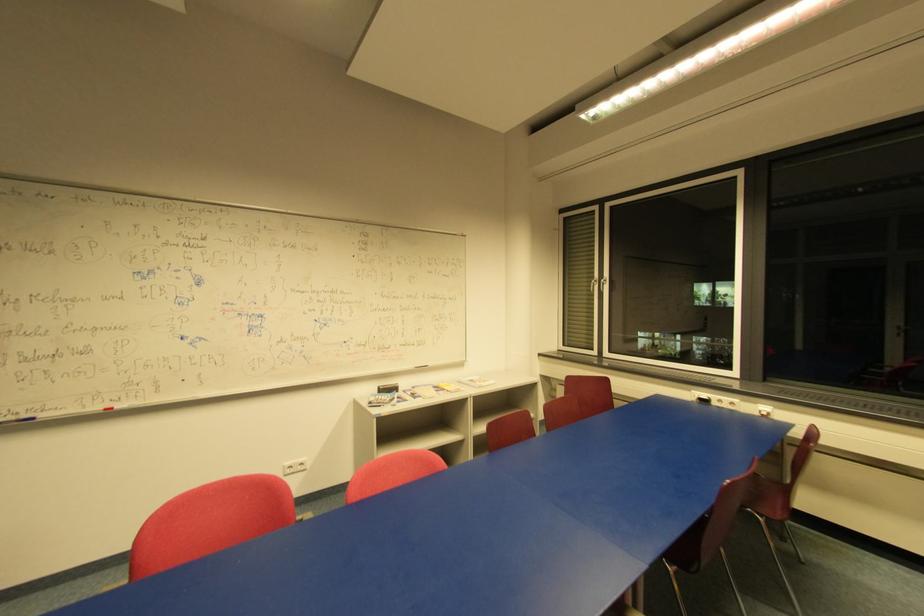
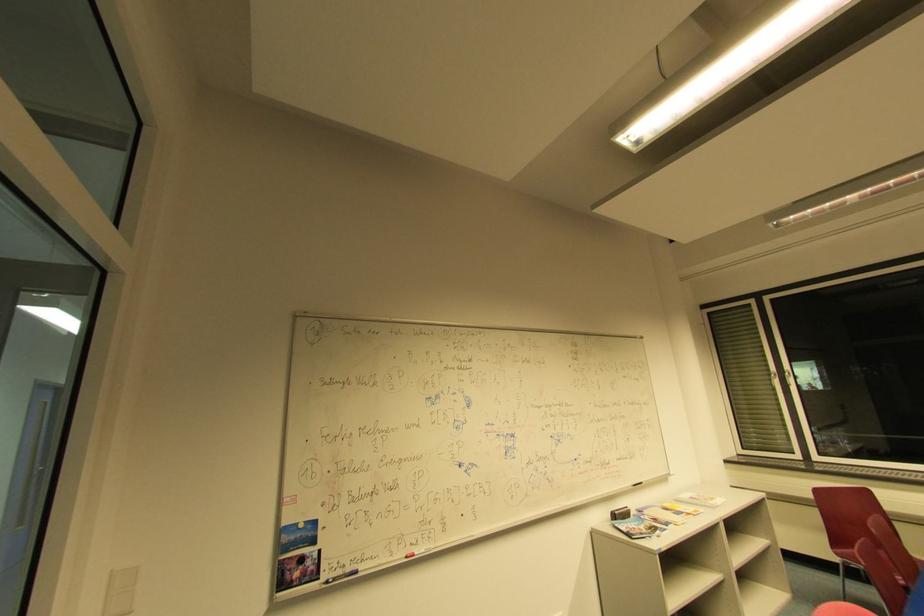
Question: The images are taken continuously from a first-person perspective. In which direction are you moving?

Choices:
 (A) Left
 (B) Right
 (C) Forward
 (D) Backward

Answer: (A)